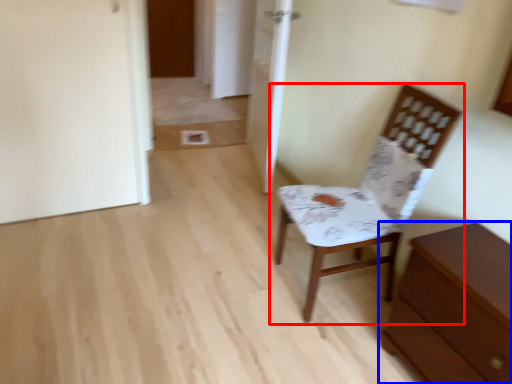
Question: Among these objects, which one is nearest to the camera, chair (highlighted by a red box) or chest of drawers (highlighted by a blue box)?

Choices:
 (A) chair
 (B) chest of drawers

Answer: (B)